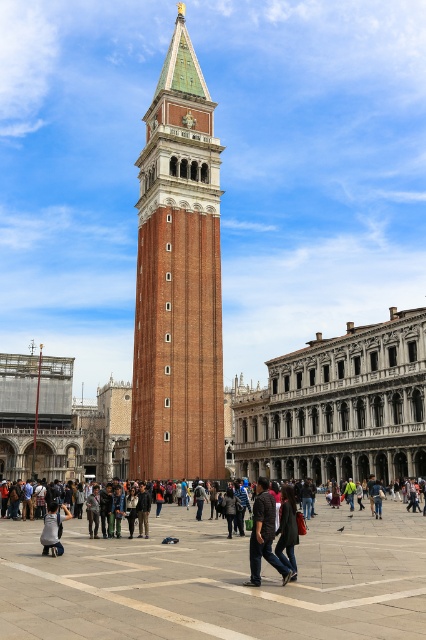
You are a tourist standing at the edge of St. Mark Square and you see two coats hanging on a rack in the center. The coats are the dark brown leather jacket at center and the dark gray fabric coat at center. Which coat is positioned lower on the rack?

The dark brown leather jacket at center is below the dark gray fabric coat at center, so it is positioned lower on the rack.

You are standing at St. Mark Square in Venice, and you see the brown brick tower at center. If you want to reach the tower within 2 minutes, what is the minimum speed you need to walk at?

The brown brick tower at center is 60.64 meters away. To reach it in 2 minutes, you need to walk at a minimum speed of 0.505 meters per second.

You are standing at the entrance of St. Mark Square and want to walk towards the concrete paving at center. Which direction should you walk?

The concrete paving at center is located at point (216, 580), so you should walk towards the center of the square to reach it.